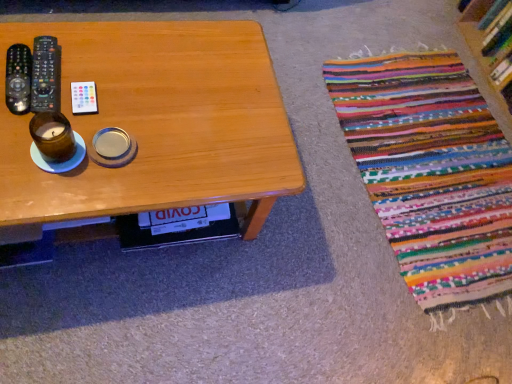
Question: From a real-world perspective, does black plastic remote control at left, which appears as the 1th remote control when viewed from the left, sit lower than wooden bookshelf at upper right?

Choices:
 (A) no
 (B) yes

Answer: (A)

Question: Is black plastic remote control at left, which appears as the 1th remote control when viewed from the left, at the right side of wooden bookshelf at upper right?

Choices:
 (A) yes
 (B) no

Answer: (B)

Question: Is black plastic remote control at left, which appears as the 1th remote control when viewed from the left, smaller than wooden bookshelf at upper right?

Choices:
 (A) no
 (B) yes

Answer: (B)

Question: Considering the relative sizes of black plastic remote control at left, positioned as the 3th remote control in right-to-left order, and wooden bookshelf at upper right in the image provided, is black plastic remote control at left, positioned as the 3th remote control in right-to-left order, taller than wooden bookshelf at upper right?

Choices:
 (A) yes
 (B) no

Answer: (B)

Question: Considering the relative sizes of black plastic remote control at left, which appears as the 1th remote control when viewed from the left, and wooden bookshelf at upper right in the image provided, is black plastic remote control at left, which appears as the 1th remote control when viewed from the left, shorter than wooden bookshelf at upper right?

Choices:
 (A) yes
 (B) no

Answer: (A)

Question: Can you confirm if black plastic remote control at left, positioned as the 3th remote control in right-to-left order, is bigger than wooden bookshelf at upper right?

Choices:
 (A) no
 (B) yes

Answer: (A)

Question: Can you confirm if brown glass candle at left is wider than black plastic remote at left, the 2th remote control in the right-to-left sequence?

Choices:
 (A) yes
 (B) no

Answer: (B)

Question: Is brown glass candle at left looking in the opposite direction of black plastic remote at left, the 2th remote control when ordered from left to right?

Choices:
 (A) yes
 (B) no

Answer: (B)

Question: Is brown glass candle at left bigger than black plastic remote at left, the 2th remote control when ordered from left to right?

Choices:
 (A) yes
 (B) no

Answer: (A)

Question: Does brown glass candle at left turn towards black plastic remote at left, the 2th remote control in the right-to-left sequence?

Choices:
 (A) no
 (B) yes

Answer: (B)

Question: Considering the relative sizes of brown glass candle at left and black plastic remote at left, the 2th remote control in the right-to-left sequence, in the image provided, is brown glass candle at left taller than black plastic remote at left, the 2th remote control in the right-to-left sequence,?

Choices:
 (A) yes
 (B) no

Answer: (A)

Question: Does brown glass candle at left have a lesser width compared to black plastic remote at left, the 2th remote control when ordered from left to right?

Choices:
 (A) yes
 (B) no

Answer: (A)

Question: Is wooden bookshelf at upper right thinner than black plastic remote control at left, positioned as the 3th remote control in right-to-left order?

Choices:
 (A) no
 (B) yes

Answer: (A)